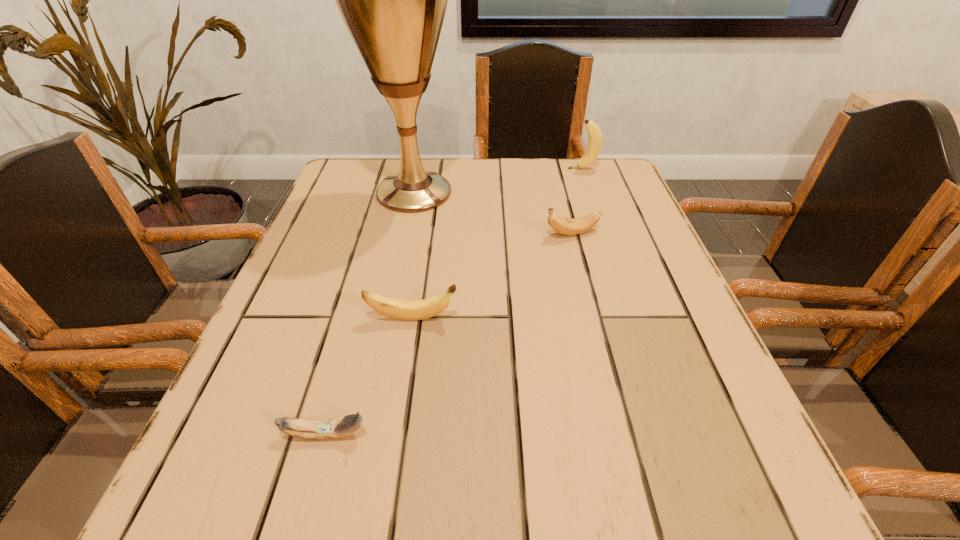
Find the location of a particular element. free region at the left edge of the desktop is located at coordinates (383, 228).

Image resolution: width=960 pixels, height=540 pixels. What are the coordinates of `vacant space at the right edge` in the screenshot? It's located at (683, 385).

The height and width of the screenshot is (540, 960). What are the coordinates of `vacant space at the near left corner of the desktop` in the screenshot? It's located at (294, 496).

In the image, there is a desktop. Identify the location of free region at the far right corner. (587, 168).

I want to click on vacant space that's between the third nearest banana and the fourth farthest object, so click(x=492, y=276).

Identify the location of vacant space in between the second tallest object and the second farthest banana. This screenshot has height=540, width=960. (577, 201).

Where is `vacant space that's between the third nearest banana and the third farthest banana`? The height and width of the screenshot is (540, 960). vacant space that's between the third nearest banana and the third farthest banana is located at coordinates (492, 276).

Where is `vacant area that lies between the second tallest object and the second farthest banana`? The width and height of the screenshot is (960, 540). vacant area that lies between the second tallest object and the second farthest banana is located at coordinates (577, 201).

Where is `empty location between the third nearest banana and the fourth farthest object`? empty location between the third nearest banana and the fourth farthest object is located at coordinates (492, 276).

I want to click on blank region between the second nearest banana and the nearest object, so click(x=369, y=376).